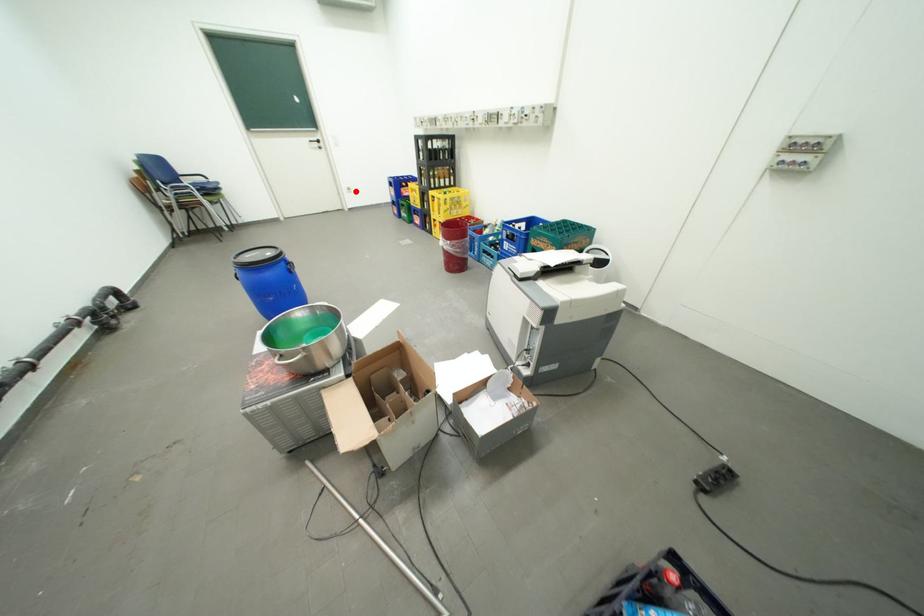
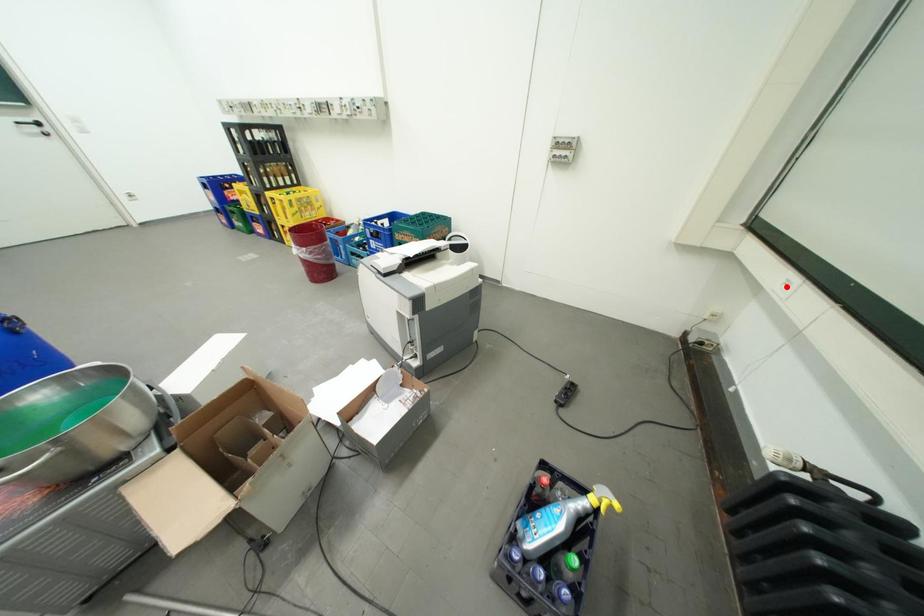
I am providing you with two images of the same scene from different viewpoints. A red point is marked on the first image and another point is marked on the second image. Are the points marked in image1 and image2 representing the same 3D position?

No